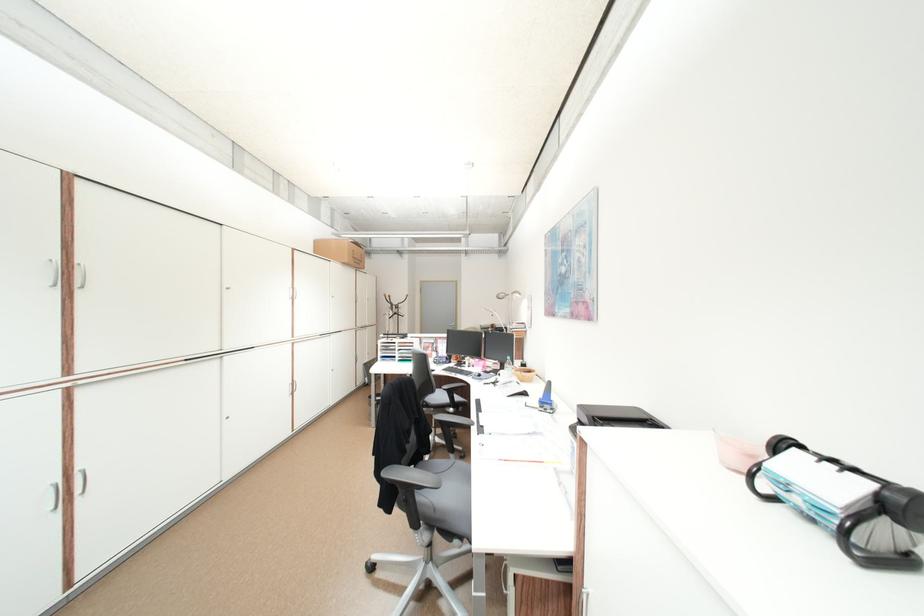
Locate an element on the screen. This screenshot has height=616, width=924. blue hole punch is located at coordinates (844, 504).